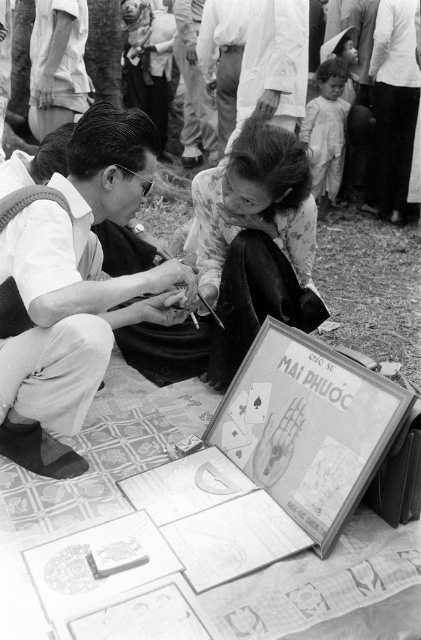
Question: Can you confirm if matte white shirt at center is positioned above floral-patterned fabric at center?

Choices:
 (A) no
 (B) yes

Answer: (A)

Question: Which of the following is the closest to the observer?

Choices:
 (A) floral-patterned fabric at center
 (B) matte white shirt at center

Answer: (B)

Question: Does matte white shirt at center have a larger size compared to floral-patterned fabric at center?

Choices:
 (A) yes
 (B) no

Answer: (A)

Question: Can you confirm if matte white shirt at center is positioned above floral-patterned fabric at center?

Choices:
 (A) yes
 (B) no

Answer: (B)